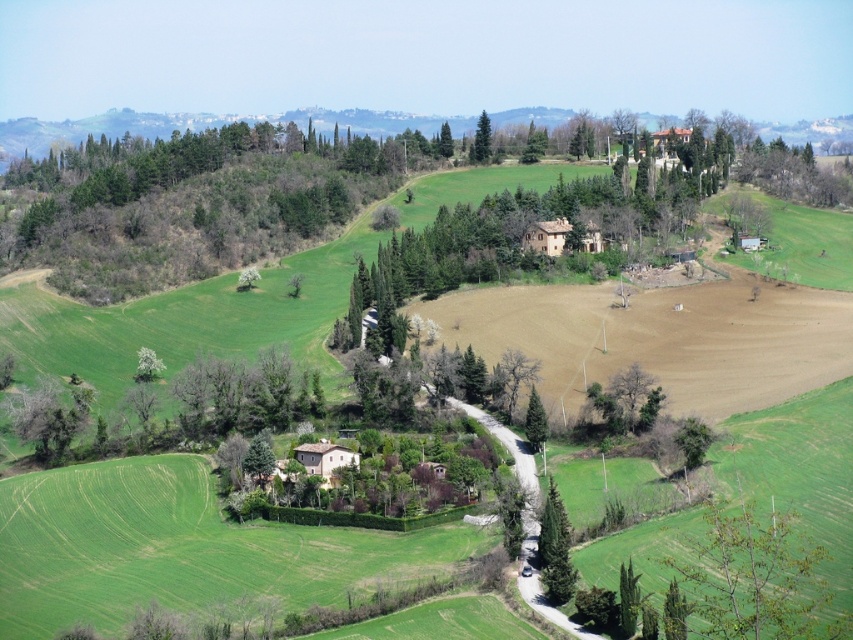
How far apart are green leafy tree at center and green leafy tree at upper center?

green leafy tree at center and green leafy tree at upper center are 240.68 meters apart.

Which is in front, point (572, 586) or point (486, 136)?

Point (572, 586) is in front.

The image size is (853, 640). I want to click on green leafy tree at center, so click(x=555, y=548).

Identify the location of green leafy tree at center. (555, 548).

In the scene shown: Is green leafy tree at lower left thinner than green textured tree at center?

In fact, green leafy tree at lower left might be wider than green textured tree at center.

This screenshot has width=853, height=640. In order to click on green leafy tree at lower left in this screenshot , I will do `click(48, 417)`.

Is green leafy tree at lower left smaller than green leafy tree at center?

No, green leafy tree at lower left is not smaller than green leafy tree at center.

Does green leafy tree at lower left have a lesser width compared to green leafy tree at center?

No.

Where is `green leafy tree at lower left`? green leafy tree at lower left is located at coordinates (48, 417).